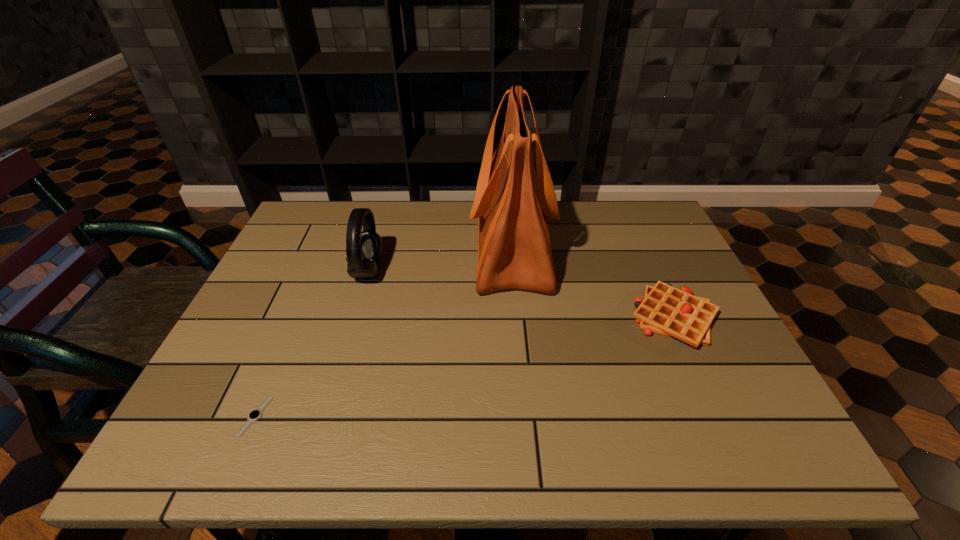
Locate an element on the screen. The image size is (960, 540). vacant area situated 0.180m on the front pocket of the shopping bag is located at coordinates (409, 248).

I want to click on vacant area situated 0.350m on the earcups of the third object from right to left, so click(510, 271).

Find the location of a particular element. The width and height of the screenshot is (960, 540). free space located on the left of the waffle is located at coordinates (468, 318).

Identify the location of vacant space situated 0.070m on the left of the leftmost object. (209, 416).

Identify the location of object at the far edge. This screenshot has width=960, height=540. (511, 204).

You are a GUI agent. You are given a task and a screenshot of the screen. Output one action in this format:
    pyautogui.click(x=<x>, y=<y>)
    Task: Click on the object at the near edge
    This screenshot has width=960, height=540.
    Given the screenshot: What is the action you would take?
    pyautogui.click(x=255, y=414)

Locate an element on the screen. This screenshot has height=540, width=960. object at the left edge is located at coordinates (255, 414).

You are a GUI agent. You are given a task and a screenshot of the screen. Output one action in this format:
    pyautogui.click(x=<x>, y=<y>)
    Task: Click on the object that is positioned at the right edge
    Image resolution: width=960 pixels, height=540 pixels.
    Given the screenshot: What is the action you would take?
    pyautogui.click(x=666, y=310)

You are a GUI agent. You are given a task and a screenshot of the screen. Output one action in this format:
    pyautogui.click(x=<x>, y=<y>)
    Task: Click on the object that is positioned at the near left corner
    The height and width of the screenshot is (540, 960).
    Given the screenshot: What is the action you would take?
    pyautogui.click(x=255, y=414)

I want to click on vacant space at the far edge, so click(370, 205).